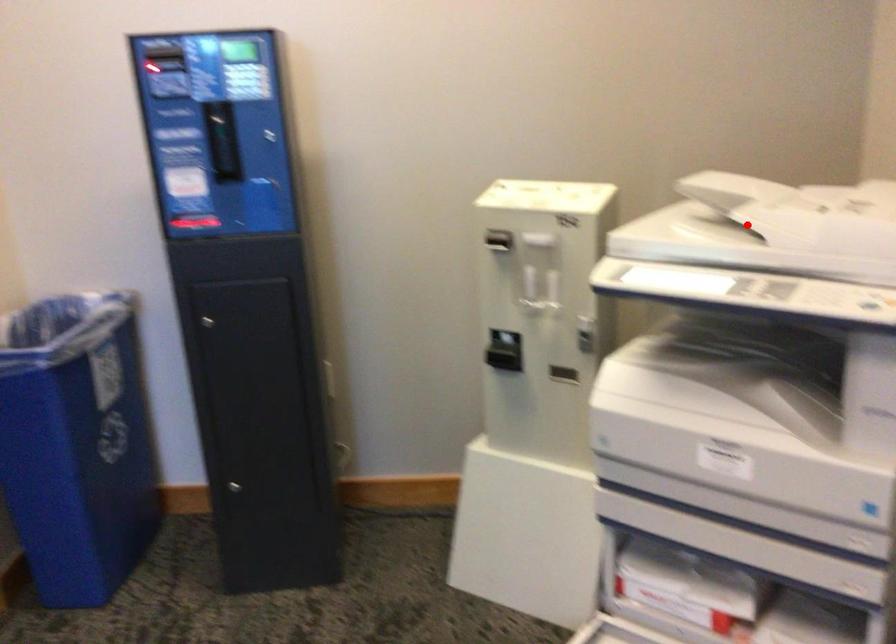
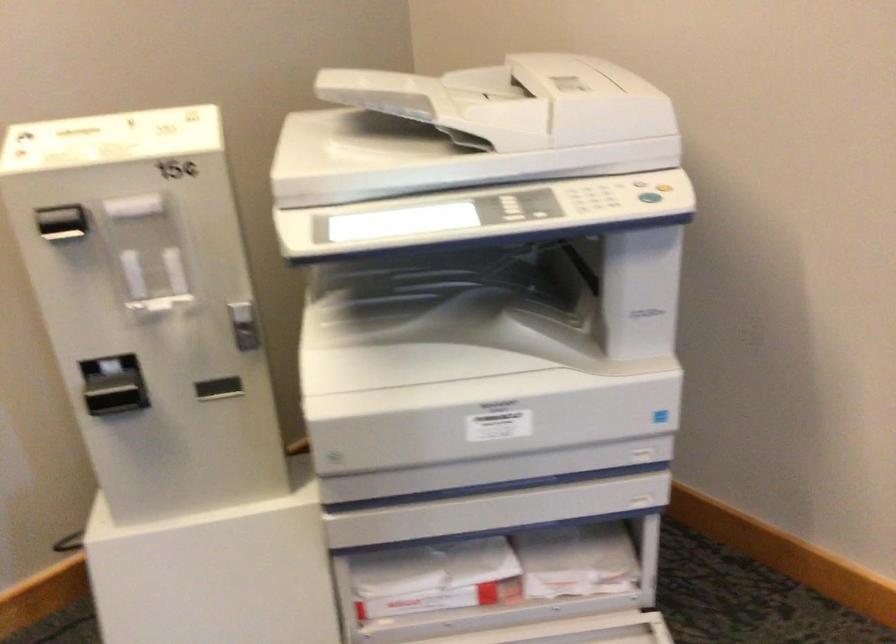
Where in the second image is the point corresponding to the highlighted location from the first image?

(470, 129)